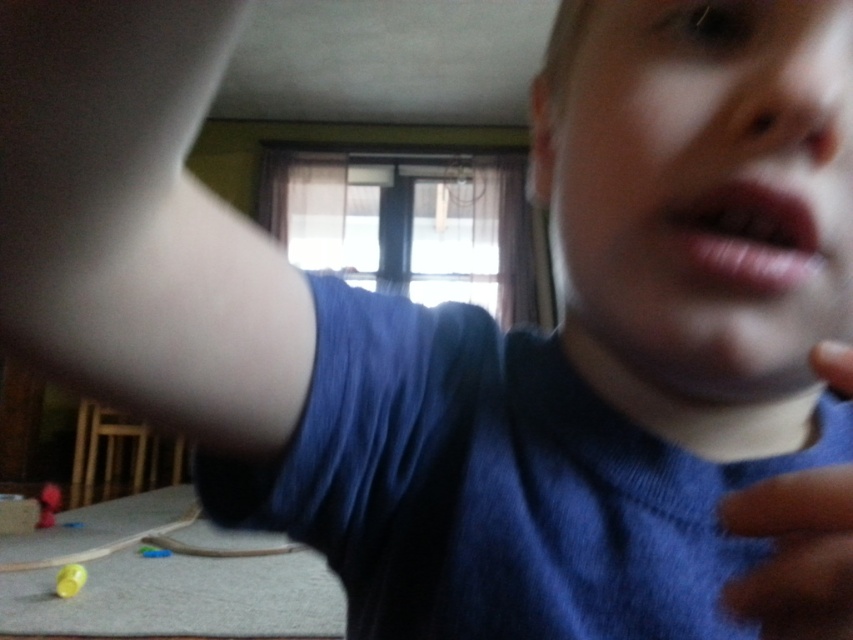
You are trying to grab the shiny yellow ball at lower left and the rubberized red ball at lower left from the carpeted floor. Which one is easier to reach without moving your feet?

The shiny yellow ball at lower left is easier to reach because it is in front of the rubberized red ball at lower left, making it closer to your current position.

You are a photographer trying to capture a clear portrait of the person in the image. You notice the blue fabric hand at lower right and the pink matte lips at center. Which object should you focus on to ensure the subject is in focus?

The blue fabric hand at lower right is larger in size compared to the pink matte lips at center, so focusing on the blue fabric hand at lower right would ensure the subject is in focus.